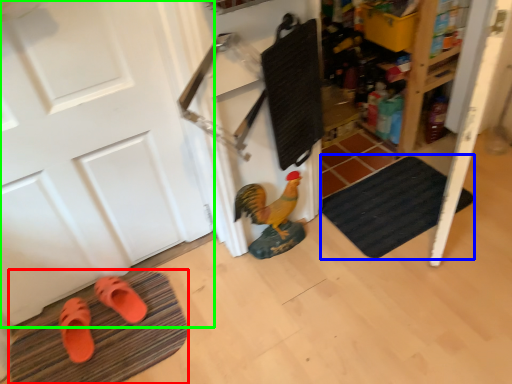
Question: Which object is positioned farthest from bath mat (highlighted by a red box)? Select from bath mat (highlighted by a blue box) and door (highlighted by a green box).

Choices:
 (A) bath mat
 (B) door

Answer: (A)